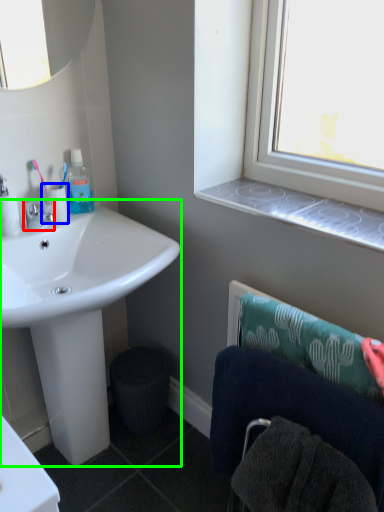
Question: Which is nearer to the tap (highlighted by a red box)? toilet paper (highlighted by a blue box) or sink (highlighted by a green box).

Choices:
 (A) toilet paper
 (B) sink

Answer: (A)